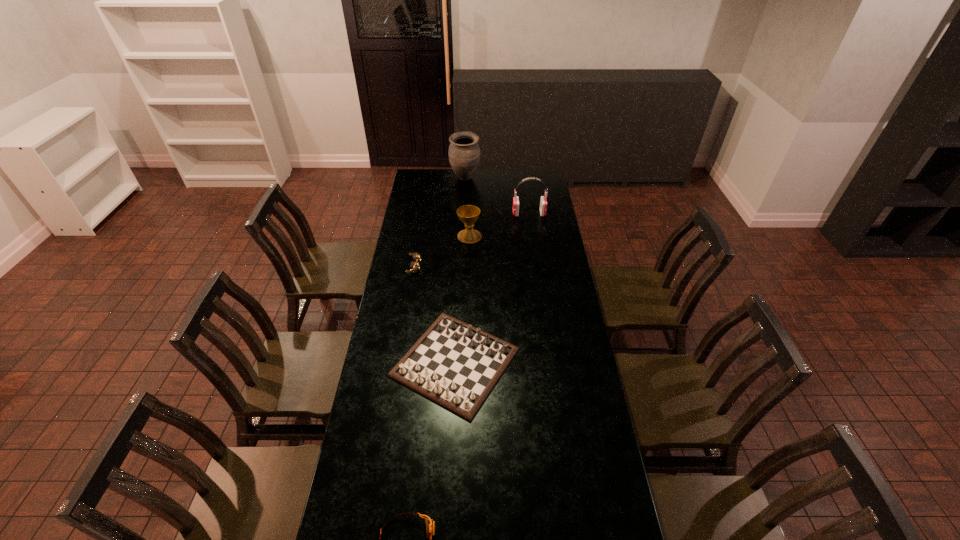
What are the coordinates of `vacant space located on the outer surface of the earphone` in the screenshot? It's located at 452,213.

What are the coordinates of `free space located on the outer surface of the earphone` in the screenshot? It's located at (457, 213).

I want to click on free space located 0.240m on the outer surface of the earphone, so click(469, 213).

The height and width of the screenshot is (540, 960). In order to click on vacant space located 0.250m on the back of the third tallest object in this screenshot , I will do `click(470, 203)`.

Where is `vacant space located 0.140m on the front of the chessboard`? This screenshot has height=540, width=960. vacant space located 0.140m on the front of the chessboard is located at coordinates (450, 462).

This screenshot has width=960, height=540. What are the coordinates of `vacant region located 0.130m through the lenses of the fourth farthest object` in the screenshot? It's located at (447, 266).

The image size is (960, 540). I want to click on object present at the far edge, so click(464, 152).

Locate an element on the screen. The image size is (960, 540). chessboard that is positioned at the left edge is located at coordinates coord(454,364).

In order to click on goggles that is at the left edge in this screenshot , I will do `click(415, 266)`.

The height and width of the screenshot is (540, 960). I want to click on object situated at the right edge, so click(x=543, y=202).